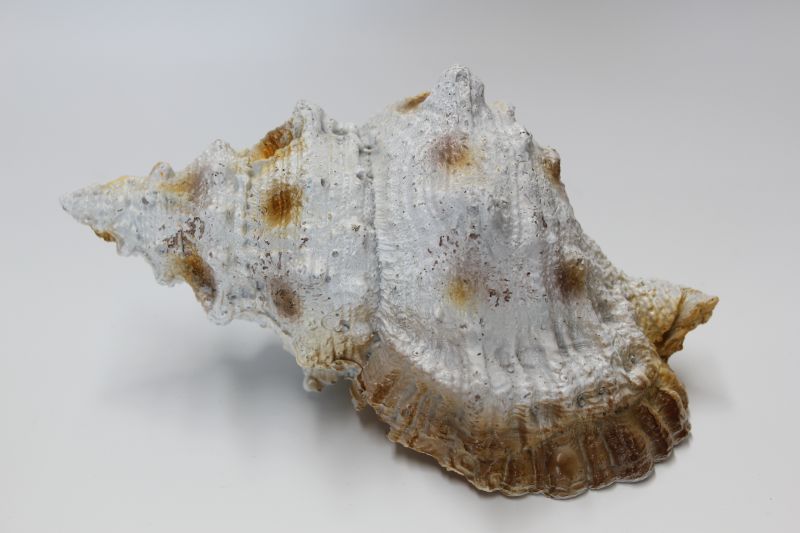
I want to click on this edge is touching the table, so click(x=482, y=492), click(x=545, y=491), click(x=612, y=482), click(x=658, y=460), click(x=682, y=442).